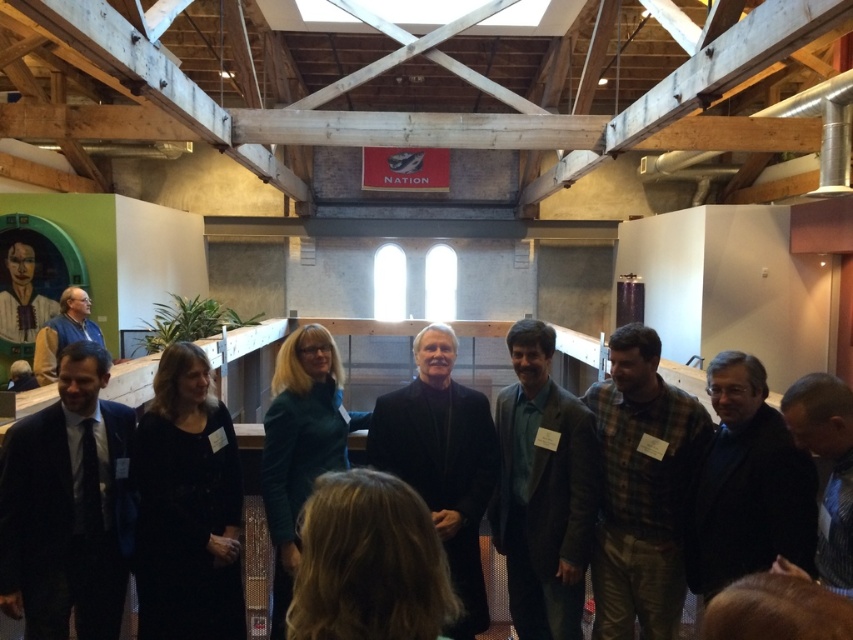
You are standing at the position of point (527, 369) and want to move forward to the front of the group. Is the point (625, 508) blocking your path?

Point (625, 508) is behind point (527, 369), so it is not blocking your path. You can move forward to the front without obstruction.